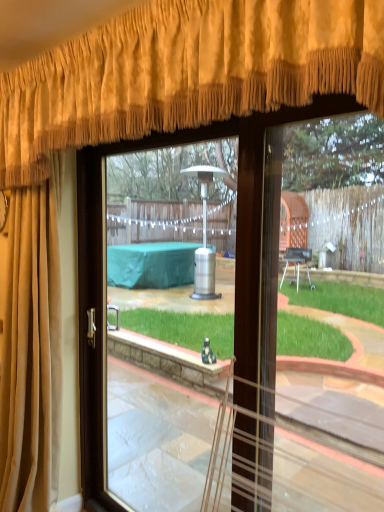
Question: Is suede-like beige curtain at upper left, the second curtain when ordered from top to bottom, oriented towards gold velvet curtain at upper center, which is the first curtain from top to bottom?

Choices:
 (A) no
 (B) yes

Answer: (A)

Question: Does suede-like beige curtain at upper left, the first curtain in the bottom-to-top sequence, touch gold velvet curtain at upper center, the second curtain positioned from the bottom?

Choices:
 (A) no
 (B) yes

Answer: (A)

Question: Is suede-like beige curtain at upper left, the first curtain in the bottom-to-top sequence, at the right side of gold velvet curtain at upper center, which is the first curtain from top to bottom?

Choices:
 (A) yes
 (B) no

Answer: (B)

Question: Is suede-like beige curtain at upper left, the second curtain when ordered from top to bottom, behind gold velvet curtain at upper center, which is the first curtain from top to bottom?

Choices:
 (A) yes
 (B) no

Answer: (A)

Question: Can gold velvet curtain at upper center, the second curtain positioned from the bottom, be found inside suede-like beige curtain at upper left, the first curtain in the bottom-to-top sequence?

Choices:
 (A) no
 (B) yes

Answer: (A)

Question: Looking at the image, does gold velvet curtain at upper center, which is the first curtain from top to bottom, seem bigger or smaller compared to clear glass door at center?

Choices:
 (A) big
 (B) small

Answer: (A)

Question: From a real-world perspective, is gold velvet curtain at upper center, the second curtain positioned from the bottom, positioned above or below clear glass door at center?

Choices:
 (A) below
 (B) above

Answer: (B)

Question: Does point (72, 91) appear closer or farther from the camera than point (97, 385)?

Choices:
 (A) farther
 (B) closer

Answer: (B)

Question: From their relative heights in the image, would you say gold velvet curtain at upper center, the second curtain positioned from the bottom, is taller or shorter than clear glass door at center?

Choices:
 (A) tall
 (B) short

Answer: (B)

Question: Is clear glass door at center taller or shorter than gold velvet curtain at upper center, the second curtain positioned from the bottom?

Choices:
 (A) tall
 (B) short

Answer: (A)

Question: Considering the positions of clear glass door at center and gold velvet curtain at upper center, the second curtain positioned from the bottom, in the image, is clear glass door at center wider or thinner than gold velvet curtain at upper center, the second curtain positioned from the bottom,?

Choices:
 (A) thin
 (B) wide

Answer: (A)

Question: Looking at the image, does clear glass door at center seem bigger or smaller compared to gold velvet curtain at upper center, which is the first curtain from top to bottom?

Choices:
 (A) big
 (B) small

Answer: (B)

Question: From a real-world perspective, is clear glass door at center above or below gold velvet curtain at upper center, which is the first curtain from top to bottom?

Choices:
 (A) above
 (B) below

Answer: (B)

Question: Do you think suede-like beige curtain at upper left, the second curtain when ordered from top to bottom, is within gold velvet curtain at upper center, which is the first curtain from top to bottom, or outside of it?

Choices:
 (A) outside
 (B) inside

Answer: (A)

Question: From a real-world perspective, is suede-like beige curtain at upper left, the first curtain in the bottom-to-top sequence, above or below gold velvet curtain at upper center, the second curtain positioned from the bottom?

Choices:
 (A) below
 (B) above

Answer: (A)